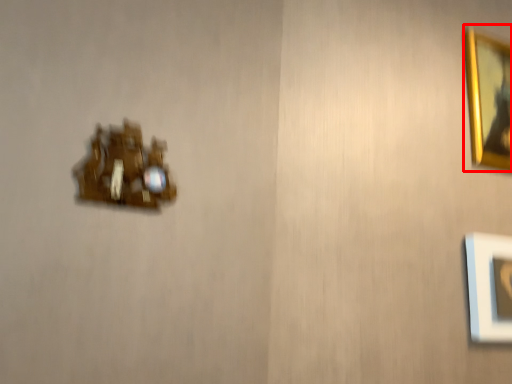
Question: Observing the image, what is the correct spatial positioning of picture frame (annotated by the red box) in reference to portrait?

Choices:
 (A) right
 (B) left

Answer: (A)